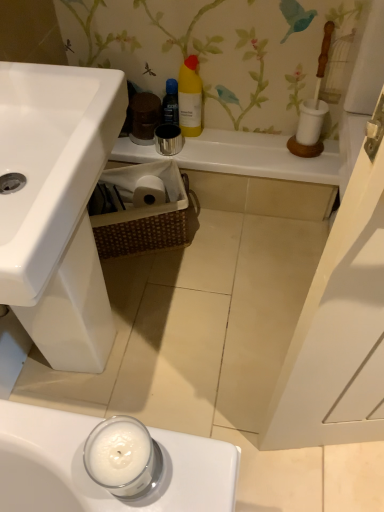
Where is `vacant space to the right of brown woven basket at lower center`? Image resolution: width=384 pixels, height=512 pixels. vacant space to the right of brown woven basket at lower center is located at coordinates (222, 244).